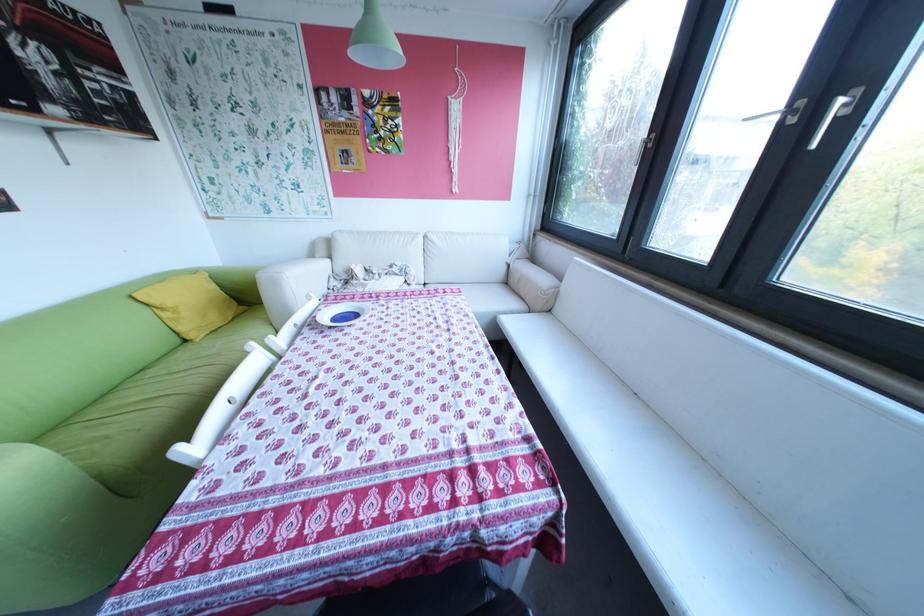
The height and width of the screenshot is (616, 924). In order to click on white sofa armrest in this screenshot , I will do `click(290, 286)`.